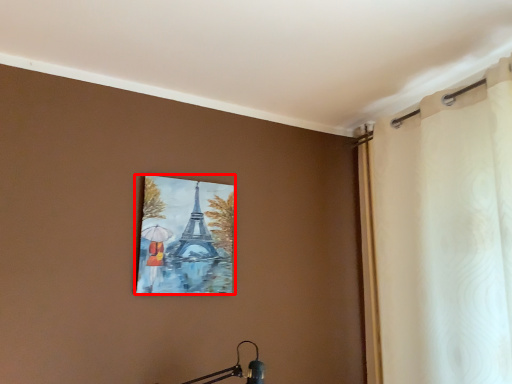
Question: From the image's perspective, what is the correct spatial positioning of picture frame (annotated by the red box) in reference to curtain?

Choices:
 (A) below
 (B) above

Answer: (A)